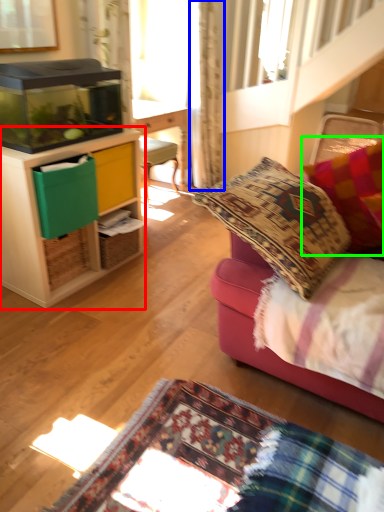
Question: Which object is positioned closest to cabinetry (highlighted by a red box)? Select from curtain (highlighted by a blue box) and pillow (highlighted by a green box).

Choices:
 (A) curtain
 (B) pillow

Answer: (B)